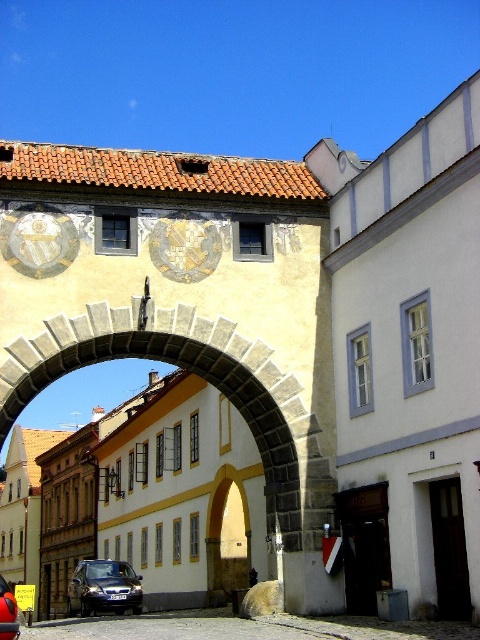
Between point (105, 570) and point (1, 608), which one is positioned in front?

Point (1, 608)

Between dark gray metallic car at lower left and shiny black car at center, which one has more height?

With more height is dark gray metallic car at lower left.

Describe the element at coordinates (104, 588) in the screenshot. I see `dark gray metallic car at lower left` at that location.

Find the location of a particular element. The image size is (480, 640). dark gray metallic car at lower left is located at coordinates (104, 588).

Which of these two, gold textured clock at center or dark gray metallic car at lower left, stands taller?

With more height is dark gray metallic car at lower left.

Does gold textured clock at center have a greater height compared to dark gray metallic car at lower left?

No, gold textured clock at center is not taller than dark gray metallic car at lower left.

Is point (206, 260) positioned after point (101, 580)?

No, (206, 260) is in front of (101, 580).

Where is `gold textured clock at center`? Image resolution: width=480 pixels, height=640 pixels. gold textured clock at center is located at coordinates (184, 246).

Can you confirm if stone archway at center is smaller than gold textured clock at center?

No, stone archway at center is not smaller than gold textured clock at center.

Looking at this image, which is more to the right, stone archway at center or gold textured clock at center?

stone archway at center

At what (x,y) coordinates should I click in order to perform the action: click on stone archway at center. Please return your answer as a coordinate pair (x, y). This screenshot has width=480, height=640. Looking at the image, I should click on (186, 368).

The image size is (480, 640). Identify the location of stone archway at center. (186, 368).